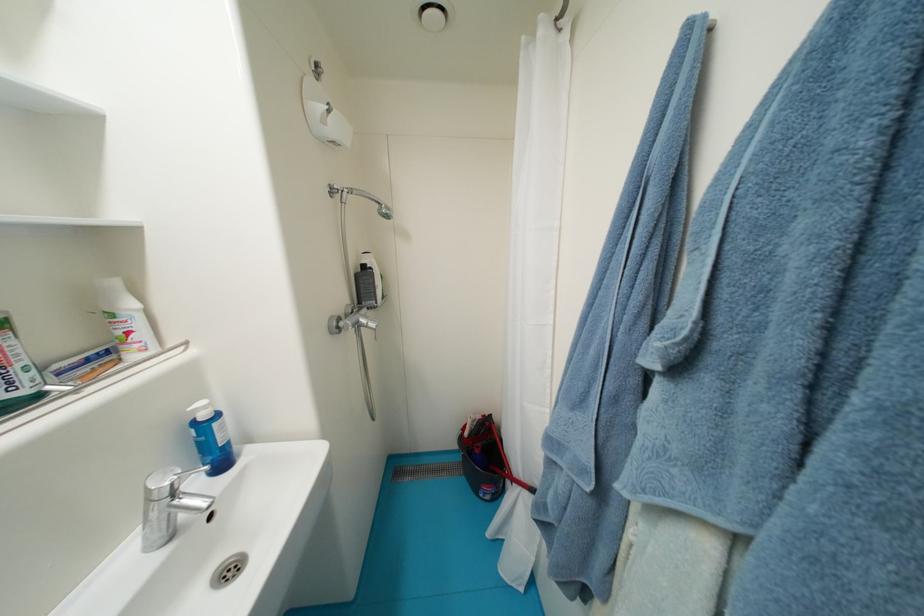
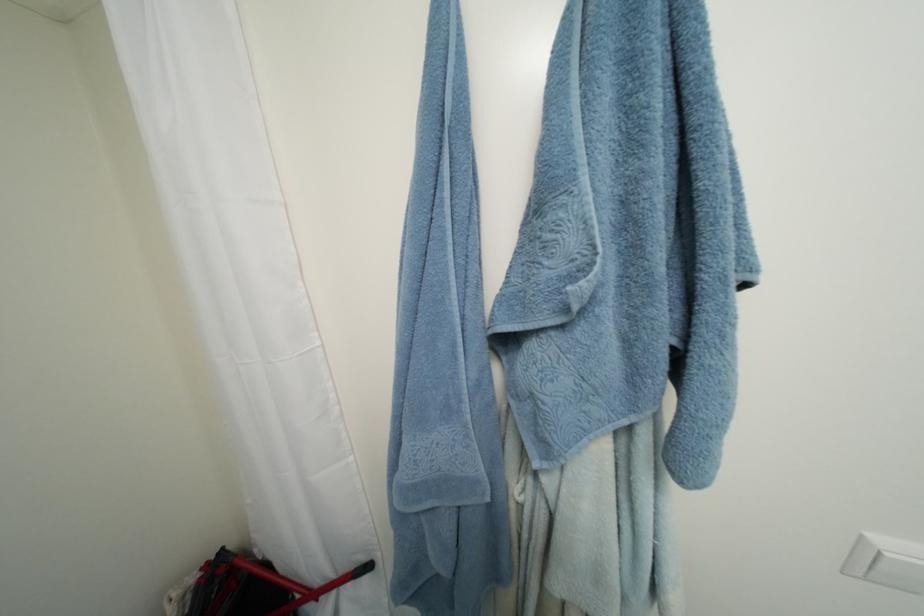
Question: The images are taken continuously from a first-person perspective. In which direction is your viewpoint rotating?

Choices:
 (A) Left
 (B) Right
 (C) Up
 (D) Down

Answer: (B)